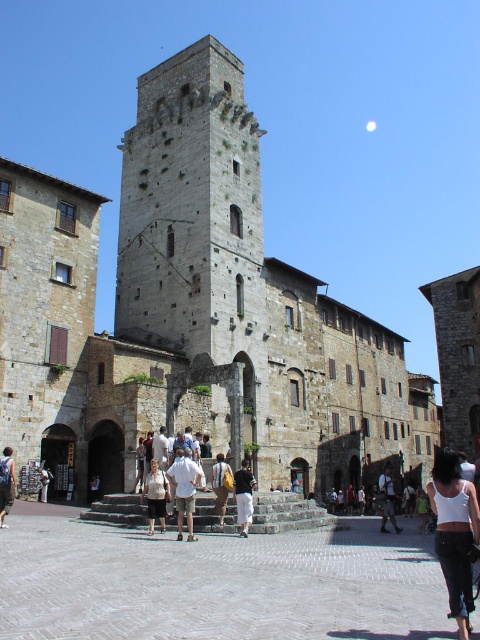
Can you confirm if white cotton tank top at lower right is smaller than camouflage pants at lower center?

Incorrect, white cotton tank top at lower right is not smaller in size than camouflage pants at lower center.

Can you confirm if white cotton tank top at lower right is thinner than camouflage pants at lower center?

In fact, white cotton tank top at lower right might be wider than camouflage pants at lower center.

At what (x,y) coordinates should I click in order to perform the action: click on white cotton tank top at lower right. Please return your answer as a coordinate pair (x, y). The image size is (480, 640). Looking at the image, I should click on (455, 532).

Is white cotton tank top at lower right above white cotton shirt at center?

No, white cotton tank top at lower right is not above white cotton shirt at center.

Is point (467, 560) positioned after point (191, 452)?

No, (467, 560) is in front of (191, 452).

Find the location of a particular element. This screenshot has width=480, height=640. white cotton tank top at lower right is located at coordinates (455, 532).

Does matte white shirt at center lie in front of camouflage pants at lower center?

That is True.

Describe the element at coordinates (156, 496) in the screenshot. I see `matte white shirt at center` at that location.

At what (x,y) coordinates should I click in order to perform the action: click on matte white shirt at center. Please return your answer as a coordinate pair (x, y). This screenshot has height=640, width=480. Looking at the image, I should click on (156, 496).